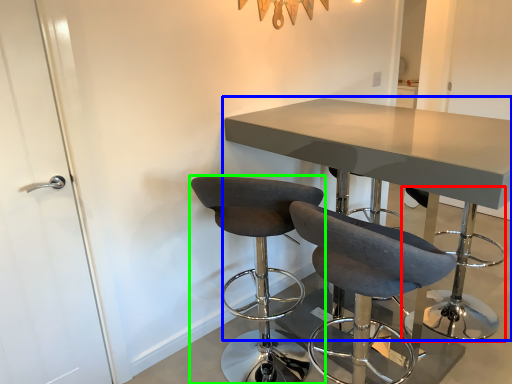
Question: Which is farther away from bar stool (highlighted by a red box)? table (highlighted by a blue box) or chair (highlighted by a green box)?

Choices:
 (A) table
 (B) chair

Answer: (A)